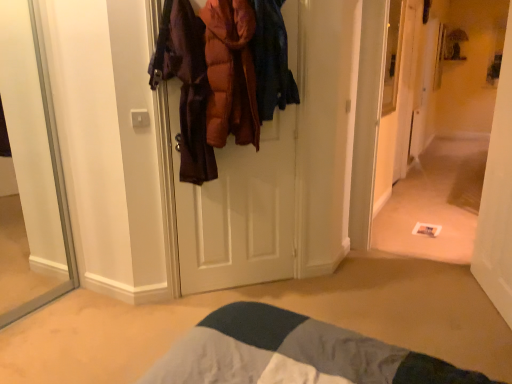
Question: From a real-world perspective, is white carpet at center on top of white glossy door at center?

Choices:
 (A) yes
 (B) no

Answer: (A)

Question: Does white carpet at center have a smaller size compared to white glossy door at center?

Choices:
 (A) no
 (B) yes

Answer: (B)

Question: From the image's perspective, is white carpet at center under white glossy door at center?

Choices:
 (A) no
 (B) yes

Answer: (A)

Question: Are white carpet at center and white glossy door at center far apart?

Choices:
 (A) yes
 (B) no

Answer: (A)

Question: Would you say white carpet at center is outside white glossy door at center?

Choices:
 (A) no
 (B) yes

Answer: (B)

Question: Is white glossy door at center to the left or to the right of white carpet at center in the image?

Choices:
 (A) right
 (B) left

Answer: (A)

Question: Does point (509, 54) appear closer or farther from the camera than point (480, 71)?

Choices:
 (A) closer
 (B) farther

Answer: (A)

Question: Looking at their shapes, would you say white glossy door at center is wider or thinner than white carpet at center?

Choices:
 (A) wide
 (B) thin

Answer: (A)

Question: From a real-world perspective, relative to white carpet at center, is white glossy door at center vertically above or below?

Choices:
 (A) below
 (B) above

Answer: (A)

Question: Relative to white carpet at center, is orange puffy jacket at center in front or behind?

Choices:
 (A) front
 (B) behind

Answer: (A)

Question: Would you say orange puffy jacket at center is inside or outside white carpet at center?

Choices:
 (A) inside
 (B) outside

Answer: (B)

Question: Considering the positions of orange puffy jacket at center and white carpet at center in the image, is orange puffy jacket at center bigger or smaller than white carpet at center?

Choices:
 (A) big
 (B) small

Answer: (B)

Question: In terms of height, does orange puffy jacket at center look taller or shorter compared to white carpet at center?

Choices:
 (A) tall
 (B) short

Answer: (B)

Question: Considering their positions, is orange puffy jacket at center located in front of or behind white glossy door at center?

Choices:
 (A) behind
 (B) front

Answer: (A)

Question: Is orange puffy jacket at center situated inside white glossy door at center or outside?

Choices:
 (A) outside
 (B) inside

Answer: (A)